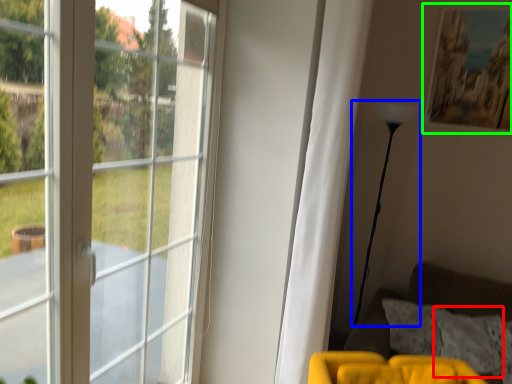
Question: Based on their relative distances, which object is nearer to pillow (highlighted by a red box)? Choose from lamp (highlighted by a blue box) and picture frame (highlighted by a green box).

Choices:
 (A) lamp
 (B) picture frame

Answer: (A)